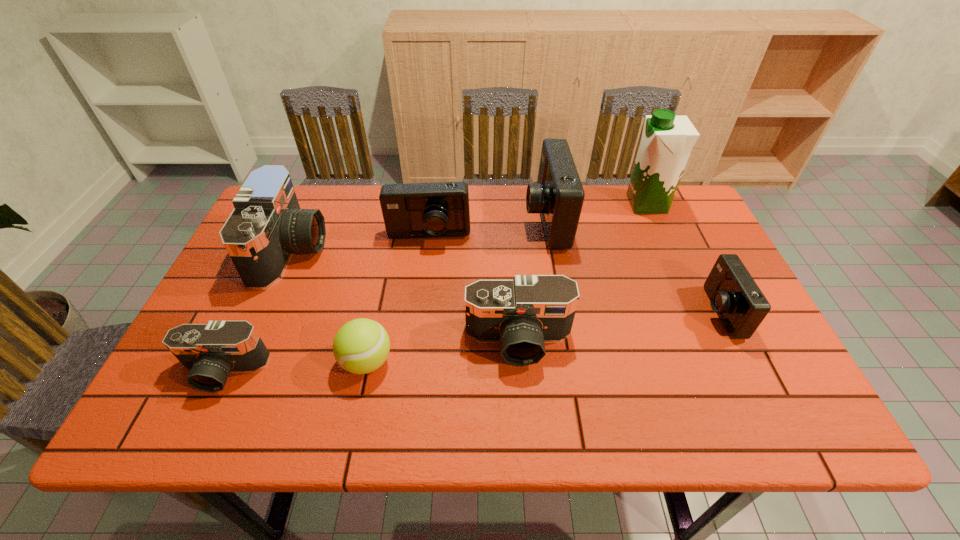
Where is `vacant region located on the front-facing side of the smallest blue camera`? vacant region located on the front-facing side of the smallest blue camera is located at coordinates coord(629,312).

In order to click on free space located on the front-facing side of the smallest blue camera in this screenshot , I will do `click(625, 312)`.

Where is `vacant space located 0.090m on the left of the tennis ball`? This screenshot has width=960, height=540. vacant space located 0.090m on the left of the tennis ball is located at coordinates (300, 362).

I want to click on vacant area located 0.070m on the front-facing side of the smallest black camera, so click(x=198, y=427).

The width and height of the screenshot is (960, 540). What are the coordinates of `soya milk at the far edge` in the screenshot? It's located at (667, 140).

Locate an element on the screen. The width and height of the screenshot is (960, 540). object positioned at the near edge is located at coordinates (211, 351).

Locate an element on the screen. This screenshot has width=960, height=540. soya milk that is at the right edge is located at coordinates (667, 140).

The height and width of the screenshot is (540, 960). In order to click on camera that is at the right edge in this screenshot , I will do `click(734, 295)`.

What are the coordinates of `object that is at the far left corner` in the screenshot? It's located at (267, 225).

The image size is (960, 540). Identify the location of object that is at the near left corner. pos(211,351).